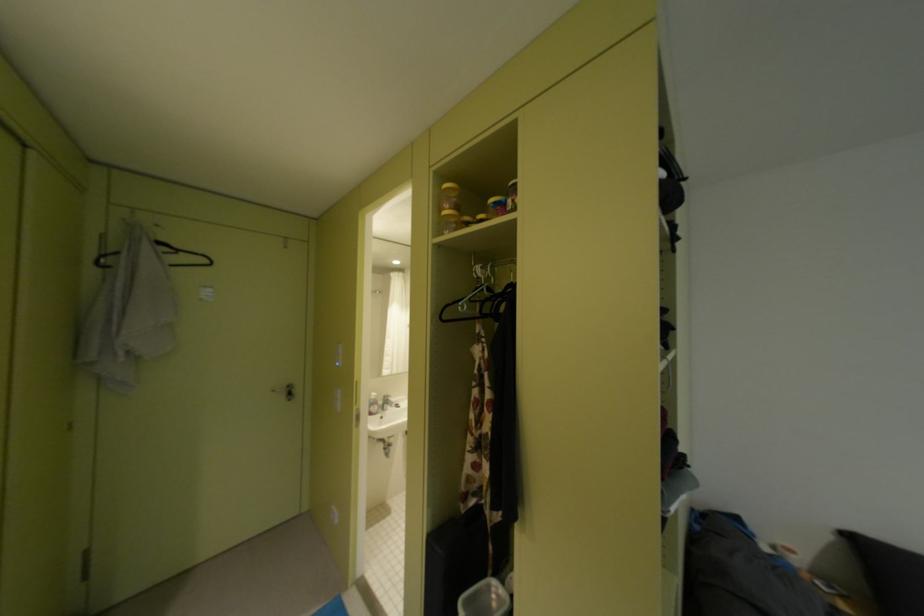
Find where to push the white light switch. Please return your answer as a coordinate pair (x, y).

(205, 293)